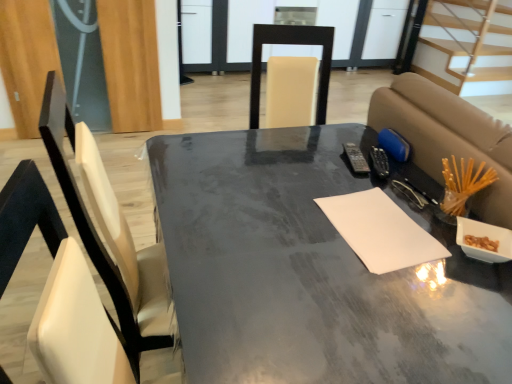
Question: Is matte gray table at center turned away from white paper at center?

Choices:
 (A) yes
 (B) no

Answer: (B)

Question: Does matte gray table at center have a larger size compared to white paper at center?

Choices:
 (A) no
 (B) yes

Answer: (B)

Question: Does matte gray table at center appear on the right side of white paper at center?

Choices:
 (A) no
 (B) yes

Answer: (A)

Question: Is matte gray table at center further to camera compared to white paper at center?

Choices:
 (A) yes
 (B) no

Answer: (B)

Question: Is matte gray table at center thinner than white paper at center?

Choices:
 (A) no
 (B) yes

Answer: (A)

Question: Is point (445, 286) closer or farther from the camera than point (481, 13)?

Choices:
 (A) closer
 (B) farther

Answer: (A)

Question: Would you say matte gray table at center is inside or outside light wood stairs at upper right?

Choices:
 (A) inside
 (B) outside

Answer: (B)

Question: Is matte gray table at center in front of or behind light wood stairs at upper right in the image?

Choices:
 (A) behind
 (B) front

Answer: (B)

Question: From the image's perspective, is matte gray table at center located above or below light wood stairs at upper right?

Choices:
 (A) below
 (B) above

Answer: (A)

Question: Is white paper at center in front of or behind light wood stairs at upper right in the image?

Choices:
 (A) front
 (B) behind

Answer: (A)

Question: Is white paper at center inside or outside of light wood stairs at upper right?

Choices:
 (A) inside
 (B) outside

Answer: (B)

Question: Considering the positions of white paper at center and light wood stairs at upper right in the image, is white paper at center taller or shorter than light wood stairs at upper right?

Choices:
 (A) tall
 (B) short

Answer: (B)

Question: From the image's perspective, is white paper at center located above or below light wood stairs at upper right?

Choices:
 (A) below
 (B) above

Answer: (A)

Question: From a real-world perspective, is white paper at center positioned above or below matte gray table at center?

Choices:
 (A) below
 (B) above

Answer: (B)

Question: From their relative heights in the image, would you say white paper at center is taller or shorter than matte gray table at center?

Choices:
 (A) tall
 (B) short

Answer: (B)